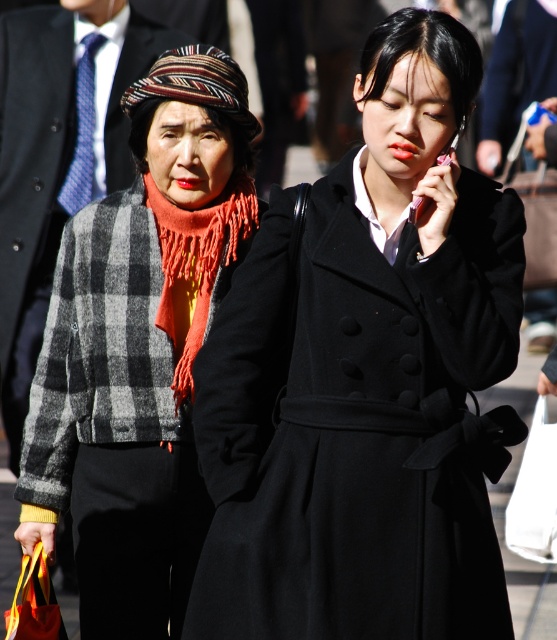
You are a photographer trying to capture a closeup of the orange fringed scarf at center and the white fabric bag at lower right. Which object should you focus on first to ensure it appears sharp in your photo?

The orange fringed scarf at center is closer to the viewer than the white fabric bag at lower right, so you should focus on the orange fringed scarf at center first to ensure it appears sharp.

You are a delivery person needing to pass between the matte black coat at center and the white fabric bag at lower right in a narrow hallway. Can you fit through the space between them if your delivery cart is 1.2 meters wide?

The matte black coat at center might be wider than white fabric bag at lower right, so the space between them may be narrower than 1.2 meters. You should check the actual width before proceeding.